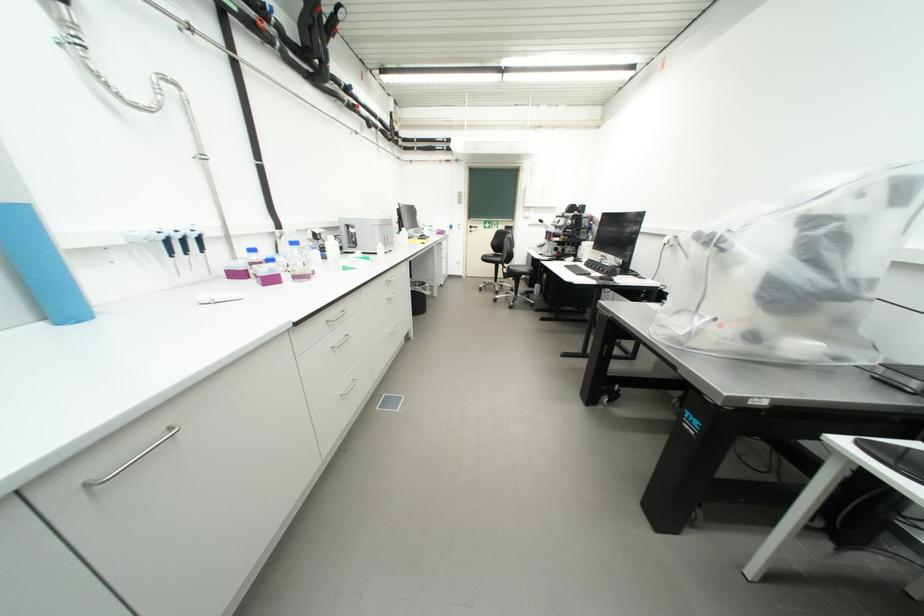
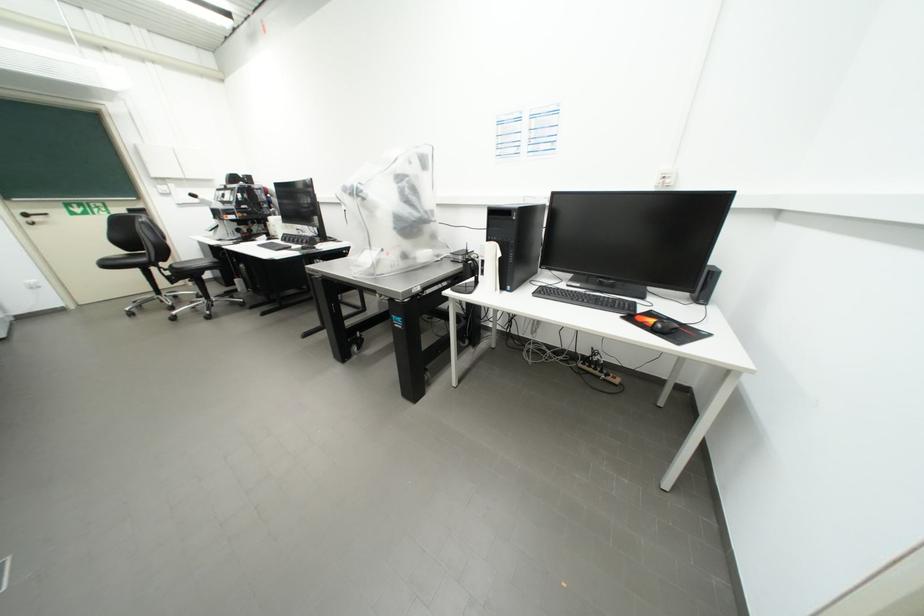
Question: The images are taken continuously from a first-person perspective. In which direction is your viewpoint rotating?

Choices:
 (A) Left
 (B) Right
 (C) Up
 (D) Down

Answer: (B)